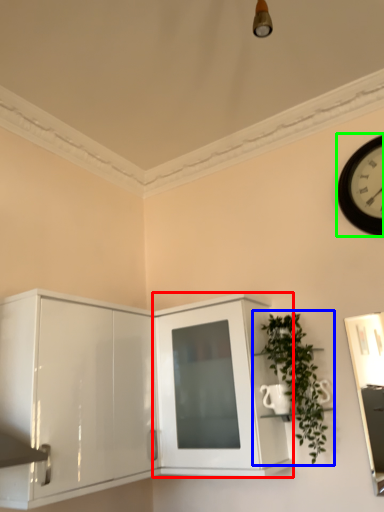
Question: Based on their relative distances, which object is farther from cabinetry (highlighted by a red box)? Choose from houseplant (highlighted by a blue box) and wall clock (highlighted by a green box).

Choices:
 (A) houseplant
 (B) wall clock

Answer: (B)